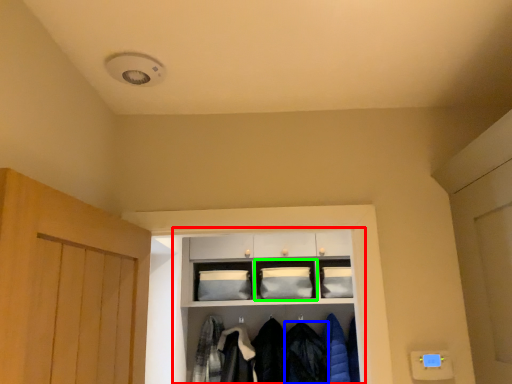
Question: Considering the real-world distances, which object is farthest from shelf (highlighted by a red box)? clothing (highlighted by a blue box) or shelf (highlighted by a green box)?

Choices:
 (A) clothing
 (B) shelf

Answer: (A)